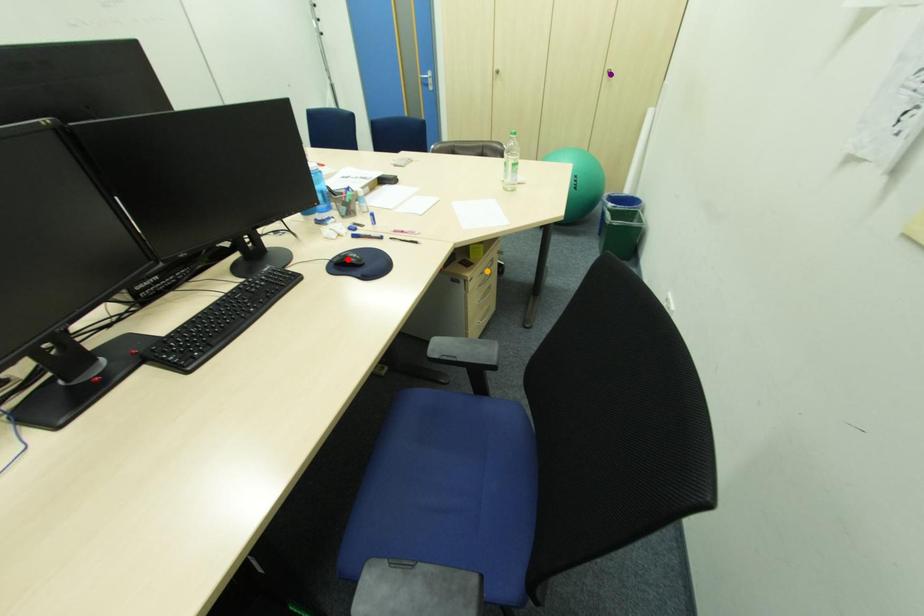
Order these from nearest to farthest:
red point | orange point | purple point

1. purple point
2. orange point
3. red point